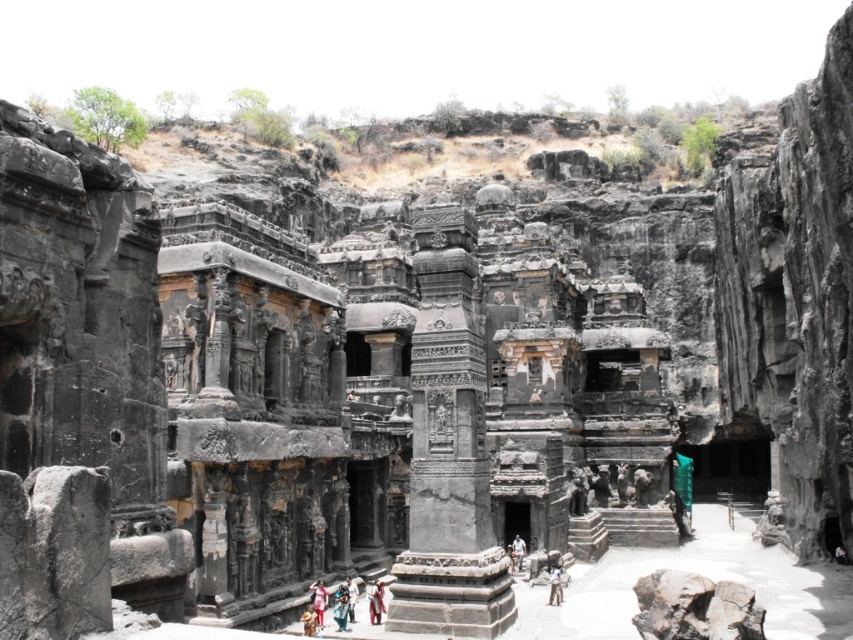
Measure the distance from white cotton shirt at center to light brown fabric person at center.

They are 18.43 meters apart.

Does point (310, 595) come closer to viewer compared to point (521, 541)?

Yes.

Is point (320, 595) less distant than point (517, 563)?

Yes, it is.

The image size is (853, 640). Identify the location of white cotton shirt at center. (318, 602).

Which is in front, point (318, 618) or point (560, 592)?

Point (318, 618)

Is white cotton shirt at center below light brown leather jacket at center?

Incorrect, white cotton shirt at center is not positioned below light brown leather jacket at center.

Which is behind, point (316, 611) or point (549, 604)?

The point (549, 604) is behind.

At what (x,y) coordinates should I click in order to perform the action: click on white cotton shirt at center. Please return your answer as a coordinate pair (x, y). Looking at the image, I should click on (318, 602).

Does blue fabric person at center have a smaller size compared to light brown fabric person at center?

Correct, blue fabric person at center occupies less space than light brown fabric person at center.

Is point (337, 621) farther from viewer compared to point (512, 552)?

That is False.

Find the location of a particular element. blue fabric person at center is located at coordinates (340, 605).